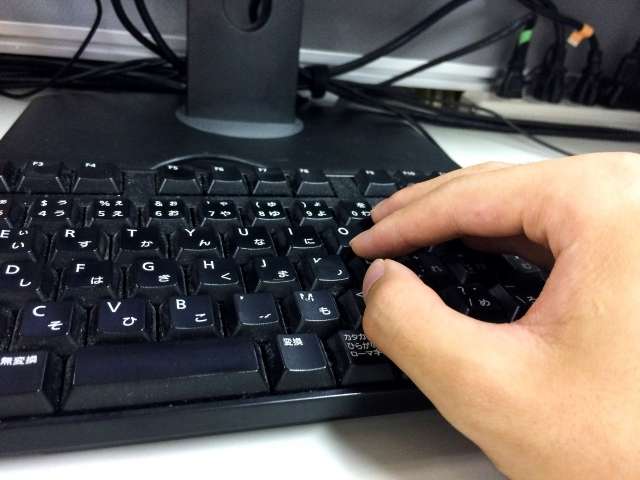
Locate an element on the screen. The width and height of the screenshot is (640, 480). key board is located at coordinates coord(187,290).